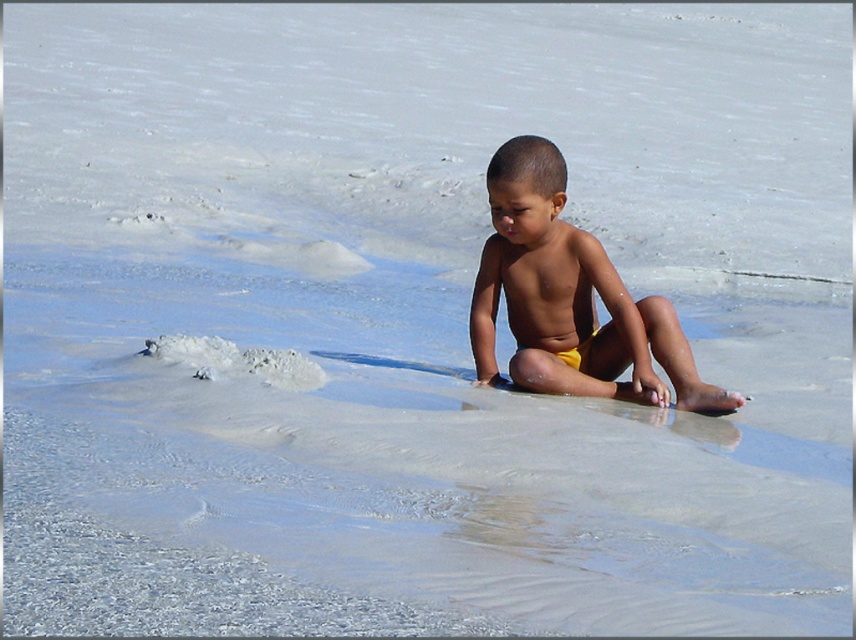
Is point (569, 241) less distant than point (522, 337)?

Yes, it is.

Can you confirm if yellow fabric shorts at center is positioned to the left of smooth yellow shorts at center?

No, yellow fabric shorts at center is not to the left of smooth yellow shorts at center.

What do you see at coordinates (569, 298) in the screenshot?
I see `yellow fabric shorts at center` at bounding box center [569, 298].

Locate an element on the screen. The height and width of the screenshot is (640, 856). yellow fabric shorts at center is located at coordinates (569, 298).